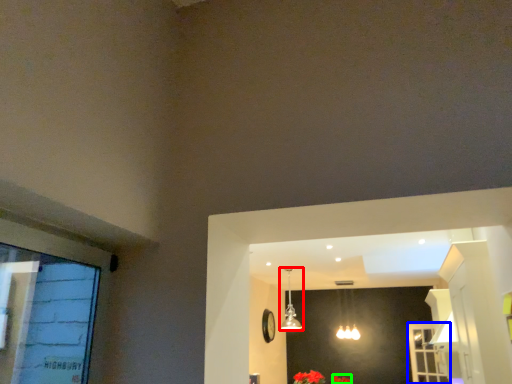
Question: Estimate the real-world distances between objects in this image. Which object is farther from lamp (highlighted by a red box), screen door (highlighted by a blue box) or flower (highlighted by a green box)?

Choices:
 (A) screen door
 (B) flower

Answer: (A)